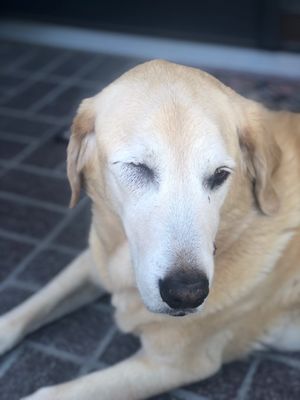
Find the location of a particular element. The image size is (300, 400). moulding is located at coordinates (147, 44).